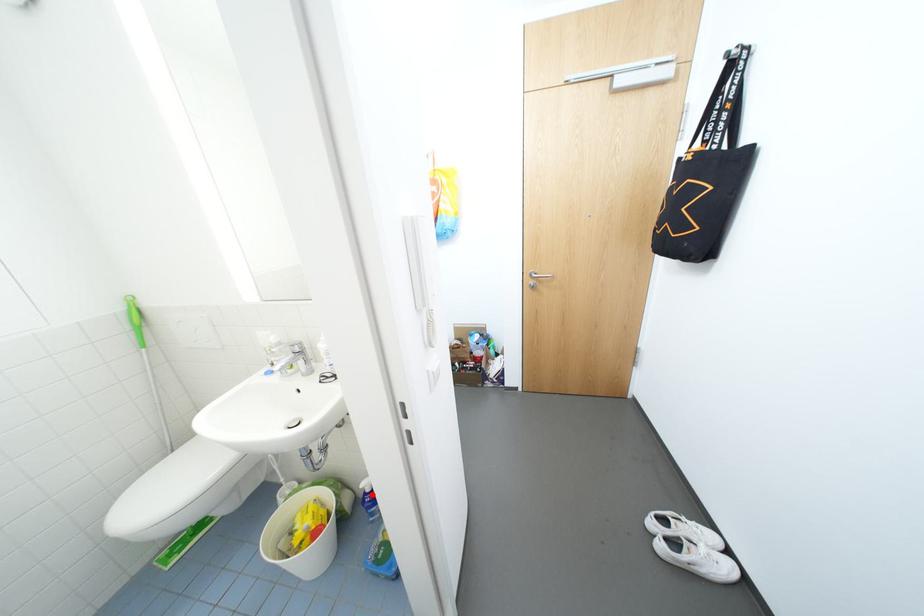
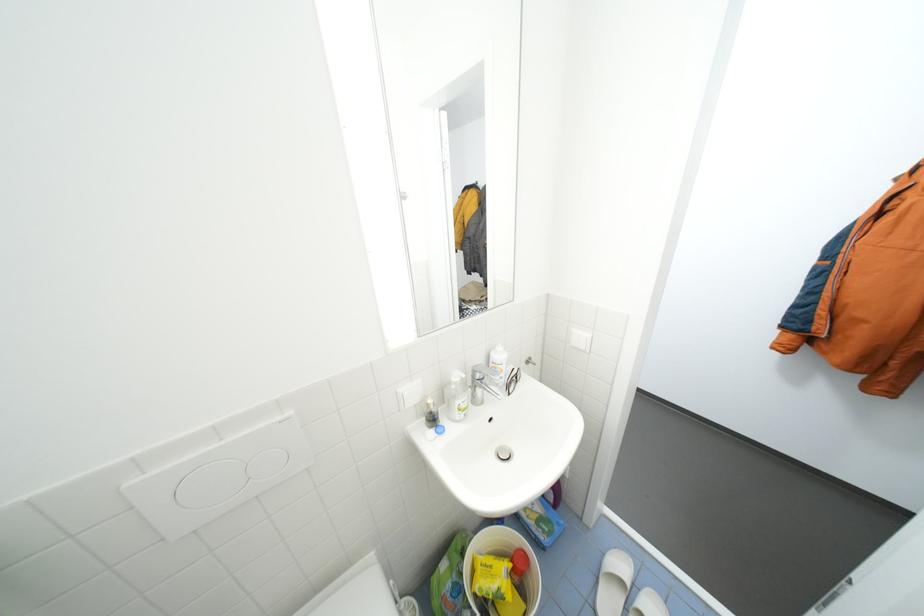
Question: I am providing you with two images of the same scene from different viewpoints. A red point is marked on the first image. Can you still see the location of the red point in image 2?

Choices:
 (A) Yes
 (B) No

Answer: (B)